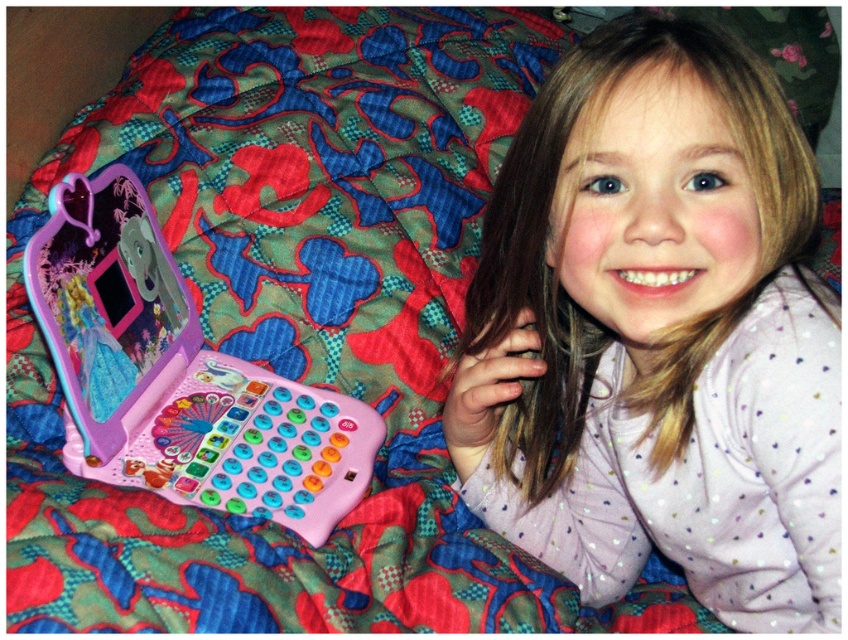
You are a child who wants to place the pink plastic toy laptop at left on top of the pink fabric at upper right. Based on the scene, do you think the laptop will fit vertically on the fabric?

The pink fabric at upper right is taller than the pink plastic toy laptop at left, so yes, the laptop will fit vertically on the fabric.

You are a drone flying above the scene. You need to deliver a small package to the point closer to the girl. Which point should you aim for, point (784, 536) or point (294, 483)?

Point (784, 536) is in front of point (294, 483), so it is closer to the girl. Therefore, the drone should aim for point (784, 536).